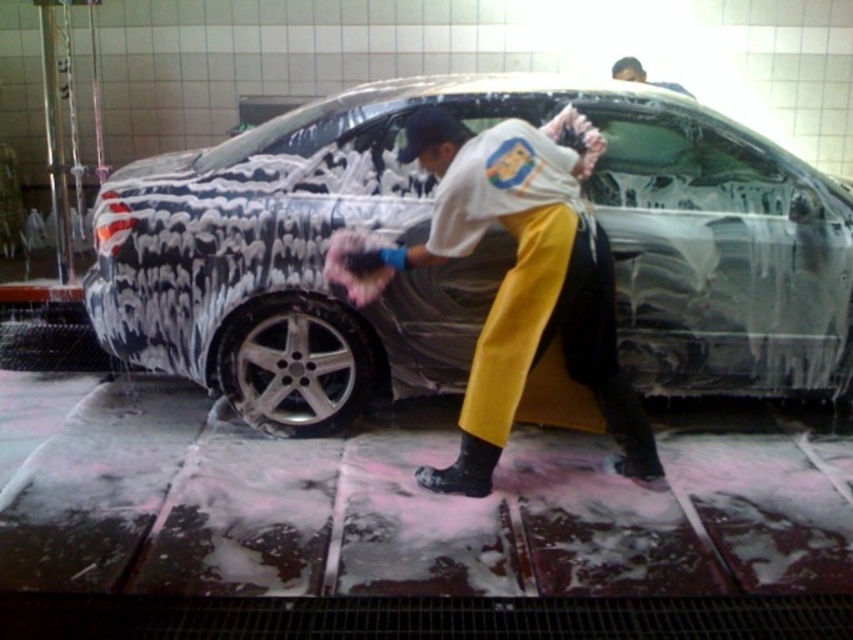
Is point (322, 212) farther from viewer compared to point (253, 355)?

That is False.

Identify the location of spongy foam-covered car at center. (468, 256).

At what (x,y) coordinates should I click in order to perform the action: click on spongy foam-covered car at center. Please return your answer as a coordinate pair (x, y). This screenshot has height=640, width=853. Looking at the image, I should click on (468, 256).

Is white cloth at center taller than silver metallic tire at lower center?

Yes, white cloth at center is taller than silver metallic tire at lower center.

Is white cloth at center bigger than silver metallic tire at lower center?

Indeed, white cloth at center has a larger size compared to silver metallic tire at lower center.

What do you see at coordinates (515, 285) in the screenshot? The width and height of the screenshot is (853, 640). I see `white cloth at center` at bounding box center [515, 285].

In order to click on white cloth at center in this screenshot , I will do `click(515, 285)`.

Is point (99, 193) positioned before point (514, 289)?

No, it is not.

Between spongy foam-covered car at center and white cloth at center, which one appears on the right side from the viewer's perspective?

white cloth at center

Measure the distance between spongy foam-covered car at center and camera.

spongy foam-covered car at center and camera are 10.73 feet apart from each other.

Where is `spongy foam-covered car at center`? The width and height of the screenshot is (853, 640). spongy foam-covered car at center is located at coordinates (468, 256).